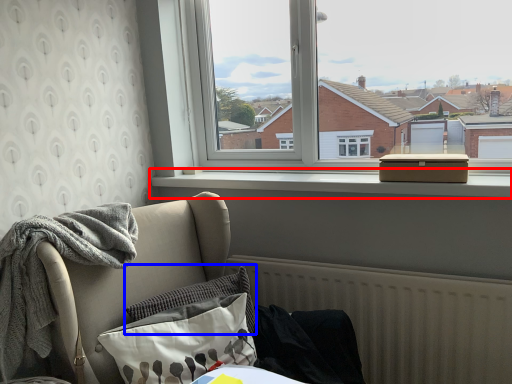
Question: Which object appears farthest to the camera in this image, window sill (highlighted by a red box) or pillow (highlighted by a blue box)?

Choices:
 (A) window sill
 (B) pillow

Answer: (A)